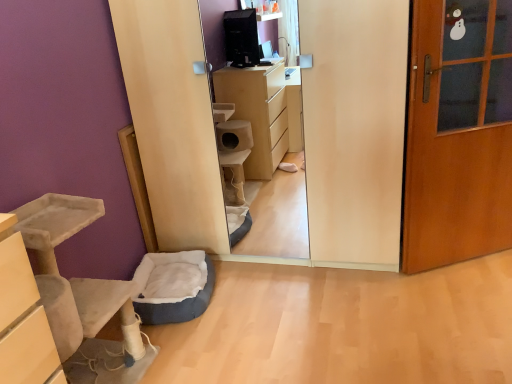
Question: Is beige suede cat tree at lower left wider or thinner than wooden door at right?

Choices:
 (A) wide
 (B) thin

Answer: (A)

Question: From a real-world perspective, is beige suede cat tree at lower left positioned above or below wooden door at right?

Choices:
 (A) above
 (B) below

Answer: (B)

Question: Considering the real-world distances, which object is closest to the wooden door at right?

Choices:
 (A) beige suede cat tree at lower left
 (B) blue fabric pet bed at lower left

Answer: (B)

Question: Estimate the real-world distances between objects in this image. Which object is farther from the wooden door at right?

Choices:
 (A) beige suede cat tree at lower left
 (B) blue fabric pet bed at lower left

Answer: (A)